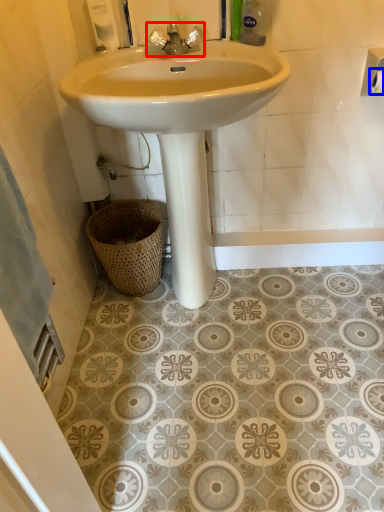
Question: Which object is closer to the camera taking this photo, tap (highlighted by a red box) or toilet paper (highlighted by a blue box)?

Choices:
 (A) tap
 (B) toilet paper

Answer: (A)